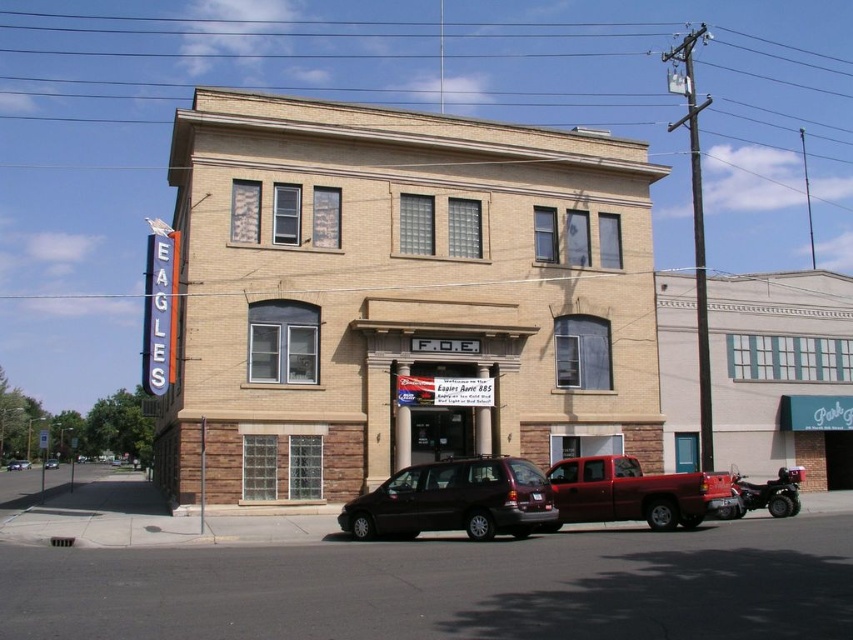
Which of these two, matte black minivan at center or metallic red truck at center, stands shorter?

metallic red truck at center

Can you confirm if matte black minivan at center is smaller than metallic red truck at center?

Indeed, matte black minivan at center has a smaller size compared to metallic red truck at center.

Who is more distant from viewer, (486, 536) or (579, 464)?

The point (579, 464) is more distant.

You are a GUI agent. You are given a task and a screenshot of the screen. Output one action in this format:
    pyautogui.click(x=<x>, y=<y>)
    Task: Click on the matte black minivan at center
    
    Given the screenshot: What is the action you would take?
    coord(454,500)

Is point (572, 484) less distant than point (47, 464)?

Yes.

Find the location of a particular element. The width and height of the screenshot is (853, 640). metallic red truck at center is located at coordinates (634, 492).

Is point (405, 531) positioned in front of point (57, 465)?

Yes, point (405, 531) is in front of point (57, 465).

Is point (519, 509) farther from camera compared to point (55, 458)?

That is False.

In order to click on matte black minivan at center in this screenshot , I will do `click(454, 500)`.